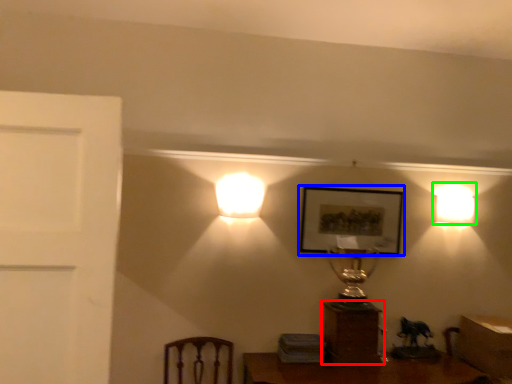
Question: Which object is the closest to the furniture (highlighted by a red box)? Choose among these: picture frame (highlighted by a blue box) or lamp (highlighted by a green box).

Choices:
 (A) picture frame
 (B) lamp

Answer: (A)